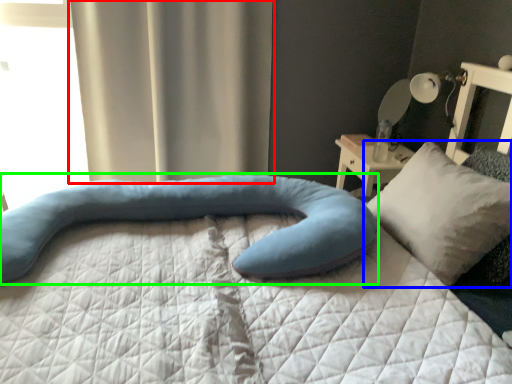
Question: Which is farther away from curtain (highlighted by a red box)? pillow (highlighted by a blue box) or pillow (highlighted by a green box)?

Choices:
 (A) pillow
 (B) pillow

Answer: (A)